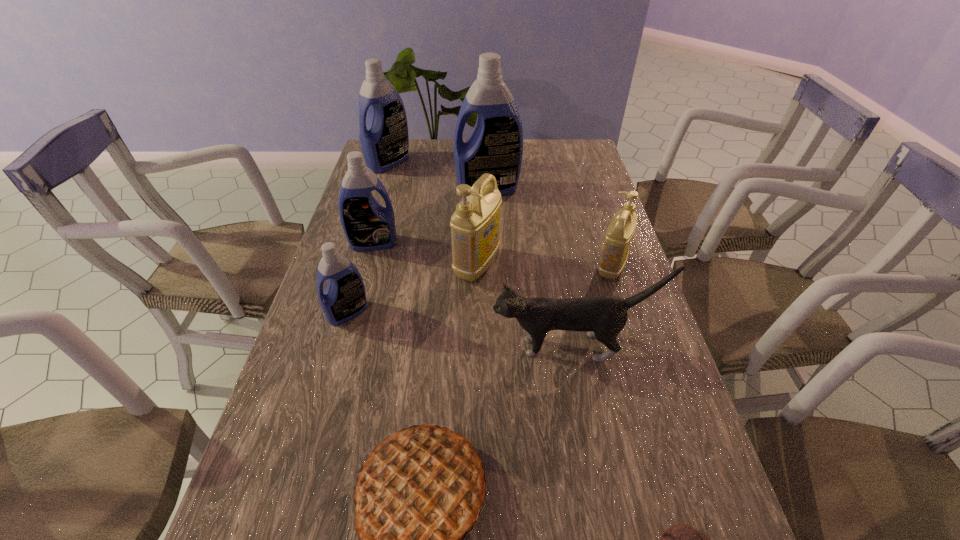
You are a GUI agent. You are given a task and a screenshot of the screen. Output one action in this format:
    pyautogui.click(x=<x>, y=<y>)
    Task: Click on the smallest blue detergent
    The image size is (960, 540).
    Given the screenshot: What is the action you would take?
    pyautogui.click(x=344, y=297)

The image size is (960, 540). In order to click on blank area located 0.110m on the left of the second farthest object in this screenshot , I will do `click(424, 190)`.

You are a GUI agent. You are given a task and a screenshot of the screen. Output one action in this format:
    pyautogui.click(x=<x>, y=<y>)
    Task: Click on the vacant space situated 0.120m on the right of the farthest blue detergent
    This screenshot has height=540, width=960.
    Given the screenshot: What is the action you would take?
    pyautogui.click(x=442, y=163)

Locate an element on the screen. Image resolution: width=960 pixels, height=540 pixels. vacant region located 0.330m on the left of the bigger beige detergent is located at coordinates (339, 266).

Image resolution: width=960 pixels, height=540 pixels. What are the coordinates of `free spot located on the back of the third farthest blue detergent` in the screenshot? It's located at (384, 205).

Image resolution: width=960 pixels, height=540 pixels. Identify the location of free space located at the face of the cat. (404, 347).

Image resolution: width=960 pixels, height=540 pixels. I want to click on vacant space situated at the face of the cat, so click(334, 347).

Locate an element on the screen. vacant space located 0.270m at the face of the cat is located at coordinates (380, 347).

Where is `vacant area located 0.220m on the back of the smaller beige detergent`? vacant area located 0.220m on the back of the smaller beige detergent is located at coordinates (593, 210).

Find the location of a particular element. This screenshot has height=540, width=960. vacant space located on the right of the fourth nearest object is located at coordinates (407, 312).